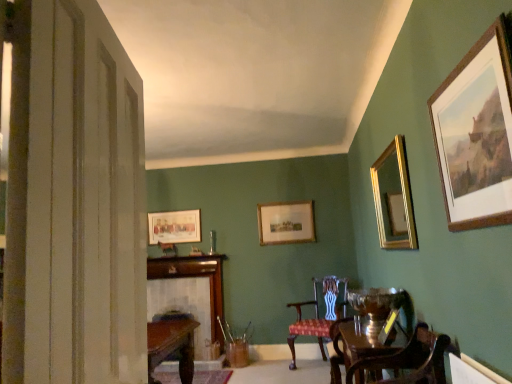
What do you see at coordinates (189, 291) in the screenshot?
I see `wooden fireplace at center` at bounding box center [189, 291].

Identify the location of red upholstered chair at center, marked as the first chair in a bottom-to-top arrangement. This screenshot has width=512, height=384. (319, 315).

This screenshot has height=384, width=512. What are the coordinates of `mahogany wood chair at lower right, which ranks as the second chair in back-to-front order` in the screenshot? It's located at (411, 359).

Image resolution: width=512 pixels, height=384 pixels. I want to click on shiny brown wood round table at lower right, so click(x=352, y=347).

Identify the location of wooden fireplace at center. The height and width of the screenshot is (384, 512). (189, 291).

Can you tell me how much wooden fireplace at center and mahogany wood chair at lower right, acting as the second chair starting from the bottom, differ in facing direction?

wooden fireplace at center and mahogany wood chair at lower right, acting as the second chair starting from the bottom, are facing 90.2 degrees away from each other.

In the scene shown: Measure the distance between wooden fireplace at center and mahogany wood chair at lower right, acting as the second chair starting from the bottom.

2.92 meters.

Is point (206, 274) positioned before point (399, 356)?

No.

Between wooden fireplace at center and mahogany wood chair at lower right, acting as the second chair starting from the bottom, which one has smaller width?

With smaller width is wooden fireplace at center.

Based on the photo, from a real-world perspective, is mahogany wood chair at lower right, arranged as the 1th chair when viewed from the front, on wooden framed picture at center, which is counted as the third picture frame, starting from the right?

Actually, mahogany wood chair at lower right, arranged as the 1th chair when viewed from the front, is physically below wooden framed picture at center, which is counted as the third picture frame, starting from the right, in the real world.

Can you confirm if mahogany wood chair at lower right, acting as the second chair starting from the bottom, is wider than wooden framed picture at center, which ranks as the 2th picture frame in left-to-right order?

Correct, the width of mahogany wood chair at lower right, acting as the second chair starting from the bottom, exceeds that of wooden framed picture at center, which ranks as the 2th picture frame in left-to-right order.

Is mahogany wood chair at lower right, acting as the second chair starting from the bottom, oriented towards wooden framed picture at center, the third picture frame positioned from the front?

No, mahogany wood chair at lower right, acting as the second chair starting from the bottom, is not facing towards wooden framed picture at center, the third picture frame positioned from the front.

Can you see mahogany wood chair at lower right, which ranks as the second chair in back-to-front order, touching wooden framed picture at center, which ranks as the 2th picture frame in left-to-right order?

No.

Based on the photo, would you say gold/gilded mirror at upper right, which ranks as the 4th picture frame in left-to-right order, is outside shiny brown wood round table at lower right?

Indeed, gold/gilded mirror at upper right, which ranks as the 4th picture frame in left-to-right order, is completely outside shiny brown wood round table at lower right.

Looking at the image, does gold/gilded mirror at upper right, which ranks as the 4th picture frame in left-to-right order, seem bigger or smaller compared to shiny brown wood round table at lower right?

In the image, gold/gilded mirror at upper right, which ranks as the 4th picture frame in left-to-right order, appears to be smaller than shiny brown wood round table at lower right.

Who is taller, gold/gilded mirror at upper right, which appears as the first picture frame when viewed from the right, or shiny brown wood round table at lower right?

gold/gilded mirror at upper right, which appears as the first picture frame when viewed from the right, is taller.

Between gold/gilded mirror at upper right, which ranks as the 4th picture frame in left-to-right order, and shiny brown wood round table at lower right, which one has smaller width?

With smaller width is gold/gilded mirror at upper right, which ranks as the 4th picture frame in left-to-right order.

From a real-world perspective, which is physically below, gold/gilded mirror at upper right, which ranks as the 4th picture frame in left-to-right order, or wooden fireplace at center?

From a 3D spatial view, wooden fireplace at center is below.

Choose the correct answer: Is gold/gilded mirror at upper right, which is the 2th picture frame from front to back, inside wooden fireplace at center or outside it?

gold/gilded mirror at upper right, which is the 2th picture frame from front to back, is not enclosed by wooden fireplace at center.

From the image's perspective, does gold/gilded mirror at upper right, which ranks as the third picture frame in back-to-front order, appear higher than wooden fireplace at center?

Yes, from the image's perspective, gold/gilded mirror at upper right, which ranks as the third picture frame in back-to-front order, is above wooden fireplace at center.

Considering the positions of objects gold/gilded mirror at upper right, which ranks as the 4th picture frame in left-to-right order, and red upholstered chair at center, marked as the first chair in a bottom-to-top arrangement, in the image provided, who is behind, gold/gilded mirror at upper right, which ranks as the 4th picture frame in left-to-right order, or red upholstered chair at center, marked as the first chair in a bottom-to-top arrangement,?

red upholstered chair at center, marked as the first chair in a bottom-to-top arrangement, is behind.

Does gold/gilded mirror at upper right, which is the 2th picture frame from front to back, have a larger size compared to red upholstered chair at center, marked as the first chair in a back-to-front arrangement?

Actually, gold/gilded mirror at upper right, which is the 2th picture frame from front to back, might be smaller than red upholstered chair at center, marked as the first chair in a back-to-front arrangement.

Which object is thinner, gold/gilded mirror at upper right, which appears as the first picture frame when viewed from the right, or red upholstered chair at center, which ranks as the 2th chair in top-to-bottom order?

gold/gilded mirror at upper right, which appears as the first picture frame when viewed from the right, is thinner.

Does gold/gilded mirror at upper right, which appears as the first picture frame when viewed from the right, turn towards red upholstered chair at center, marked as the first chair in a back-to-front arrangement?

No, gold/gilded mirror at upper right, which appears as the first picture frame when viewed from the right, is not turned towards red upholstered chair at center, marked as the first chair in a back-to-front arrangement.

In terms of height, does wooden fireplace at center look taller or shorter compared to shiny brown wood round table at lower right?

Clearly, wooden fireplace at center is taller compared to shiny brown wood round table at lower right.

Consider the image. Based on their sizes in the image, would you say wooden fireplace at center is bigger or smaller than shiny brown wood round table at lower right?

wooden fireplace at center is smaller than shiny brown wood round table at lower right.

Would you say wooden fireplace at center is a long distance from shiny brown wood round table at lower right?

wooden fireplace at center is far away from shiny brown wood round table at lower right.

From a real-world perspective, which object stands above the other?

From a 3D spatial view, wooden fireplace at center is above.

Does wooden picture frame at upper right, which is the 4th picture frame in back-to-front order, have a larger size compared to matte gold picture frame at upper left, which ranks as the first picture frame in back-to-front order?

Yes, wooden picture frame at upper right, which is the 4th picture frame in back-to-front order, is bigger than matte gold picture frame at upper left, which ranks as the first picture frame in back-to-front order.

Which point is more forward, (500, 75) or (198, 225)?

Point (500, 75)

Consider the image. How far apart are wooden picture frame at upper right, positioned as the 1th picture frame in front-to-back order, and matte gold picture frame at upper left, which appears as the first picture frame when viewed from the left?

wooden picture frame at upper right, positioned as the 1th picture frame in front-to-back order, and matte gold picture frame at upper left, which appears as the first picture frame when viewed from the left, are 4.35 meters apart from each other.

Is wooden picture frame at upper right, which ranks as the 2th picture frame in right-to-left order, turned away from matte gold picture frame at upper left, which ranks as the first picture frame in back-to-front order?

wooden picture frame at upper right, which ranks as the 2th picture frame in right-to-left order, does not have its back to matte gold picture frame at upper left, which ranks as the first picture frame in back-to-front order.

I want to click on fireplace below the mahogany wood chair at lower right, the 1th chair in the top-to-bottom sequence (from a real-world perspective), so click(189, 291).

This screenshot has height=384, width=512. In order to click on picture frame that is the 2nd object located above the mahogany wood chair at lower right, the 1th chair in the top-to-bottom sequence (from the image's perspective) in this screenshot , I will do `click(286, 223)`.

Considering their positions, is wooden framed picture at center, which is counted as the third picture frame, starting from the right, positioned further to red upholstered chair at center, which ranks as the 2th chair in top-to-bottom order, than shiny brown wood round table at lower right?

Among the two, shiny brown wood round table at lower right is located further to red upholstered chair at center, which ranks as the 2th chair in top-to-bottom order.

When comparing their distances from wooden fireplace at center, does wooden picture frame at upper right, which is the 4th picture frame in back-to-front order, or red upholstered chair at center, marked as the first chair in a bottom-to-top arrangement, seem further?

Among the two, wooden picture frame at upper right, which is the 4th picture frame in back-to-front order, is located further to wooden fireplace at center.

Estimate the real-world distances between objects in this image. Which object is further from wooden fireplace at center, matte gold picture frame at upper left, which ranks as the first picture frame in back-to-front order, or wooden framed picture at center, which ranks as the 2th picture frame in left-to-right order?

wooden framed picture at center, which ranks as the 2th picture frame in left-to-right order, lies further to wooden fireplace at center than the other object.

From the image, which object appears to be nearer to mahogany wood chair at lower right, which ranks as the second chair in back-to-front order, shiny brown wood round table at lower right or wooden picture frame at upper right, which is the third picture frame from left to right?

shiny brown wood round table at lower right.

Looking at the image, which one is located closer to gold/gilded mirror at upper right, which ranks as the third picture frame in back-to-front order, matte gold picture frame at upper left, arranged as the 4th picture frame when viewed from the front, or wooden framed picture at center, arranged as the second picture frame when viewed from the back?

The object closer to gold/gilded mirror at upper right, which ranks as the third picture frame in back-to-front order, is wooden framed picture at center, arranged as the second picture frame when viewed from the back.

Considering their positions, is mahogany wood chair at lower right, acting as the second chair starting from the bottom, positioned closer to shiny brown wood round table at lower right than gold/gilded mirror at upper right, which is the 2th picture frame from front to back?

Among the two, mahogany wood chair at lower right, acting as the second chair starting from the bottom, is located nearer to shiny brown wood round table at lower right.

Looking at the image, which one is located further to red upholstered chair at center, positioned as the 2th chair in front-to-back order, mahogany wood chair at lower right, acting as the second chair starting from the bottom, or shiny brown wood round table at lower right?

mahogany wood chair at lower right, acting as the second chair starting from the bottom, is positioned further to the anchor red upholstered chair at center, positioned as the 2th chair in front-to-back order.

Estimate the real-world distances between objects in this image. Which object is closer to wooden picture frame at upper right, which ranks as the 2th picture frame in right-to-left order, shiny brown wood round table at lower right or wooden fireplace at center?

Based on the image, shiny brown wood round table at lower right appears to be nearer to wooden picture frame at upper right, which ranks as the 2th picture frame in right-to-left order.

Where is `fireplace positioned between wooden picture frame at upper right, which ranks as the 2th picture frame in right-to-left order, and matte gold picture frame at upper left, which ranks as the first picture frame in back-to-front order, from near to far`? The width and height of the screenshot is (512, 384). fireplace positioned between wooden picture frame at upper right, which ranks as the 2th picture frame in right-to-left order, and matte gold picture frame at upper left, which ranks as the first picture frame in back-to-front order, from near to far is located at coordinates (189, 291).

Identify the location of picture frame located between mahogany wood chair at lower right, the 1th chair in the top-to-bottom sequence, and red upholstered chair at center, marked as the first chair in a back-to-front arrangement, in the depth direction. (394, 198).

The image size is (512, 384). Identify the location of chair between mahogany wood chair at lower right, acting as the second chair starting from the bottom, and matte gold picture frame at upper left, arranged as the 4th picture frame when viewed from the front, in the front-back direction. (319, 315).

Locate an element on the screen. chair between gold/gilded mirror at upper right, which is the 2th picture frame from front to back, and matte gold picture frame at upper left, which ranks as the first picture frame in back-to-front order, along the z-axis is located at coordinates (319, 315).